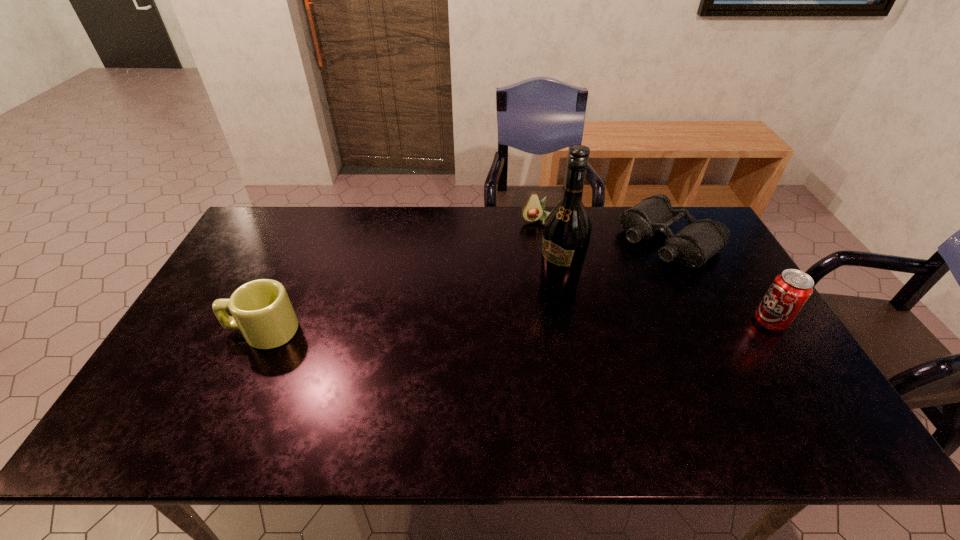
Image resolution: width=960 pixels, height=540 pixels. What are the coordinates of `free area in between the second tallest object and the mug` in the screenshot? It's located at (516, 327).

Identify the location of vacant point located between the leftmost object and the avocado. The height and width of the screenshot is (540, 960). (399, 276).

At what (x,y) coordinates should I click in order to perform the action: click on vacant space that's between the leftmost object and the avocado. Please return your answer as a coordinate pair (x, y). The image size is (960, 540). Looking at the image, I should click on (399, 276).

Where is `free space between the shortest object and the wine bottle`? free space between the shortest object and the wine bottle is located at coordinates (613, 263).

The width and height of the screenshot is (960, 540). Find the location of `vacant space that's between the avocado and the second tallest object`. vacant space that's between the avocado and the second tallest object is located at coordinates (654, 272).

The width and height of the screenshot is (960, 540). I want to click on free space between the wine bottle and the binoculars, so [x=613, y=263].

Locate an element on the screen. This screenshot has height=540, width=960. the second closest object to the wine bottle is located at coordinates (533, 210).

This screenshot has width=960, height=540. In order to click on object that is the second closest to the avocado in this screenshot , I will do `click(567, 229)`.

Identify the location of blank area in the image that satisfies the following two spatial constraints: 1. on the front side of the soda; 2. on the right side of the avocado. (553, 322).

At what (x,y) coordinates should I click in order to perform the action: click on free spot that satisfies the following two spatial constraints: 1. on the front side of the soda; 2. on the left side of the wine bottle. Please return your answer as a coordinate pair (x, y). The width and height of the screenshot is (960, 540). Looking at the image, I should click on (564, 322).